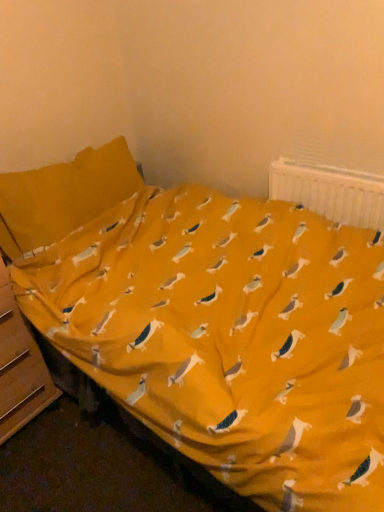
Question: Is point (337, 184) positioned closer to the camera than point (24, 404)?

Choices:
 (A) closer
 (B) farther

Answer: (A)

Question: Considering the relative positions of white plastic radiator at upper right and wooden file cabinet at lower left in the image provided, is white plastic radiator at upper right to the left or to the right of wooden file cabinet at lower left?

Choices:
 (A) right
 (B) left

Answer: (A)

Question: Considering their positions, is white plastic radiator at upper right located in front of or behind wooden file cabinet at lower left?

Choices:
 (A) behind
 (B) front

Answer: (A)

Question: Is wooden file cabinet at lower left inside the boundaries of white plastic radiator at upper right, or outside?

Choices:
 (A) inside
 (B) outside

Answer: (B)

Question: In terms of width, does wooden file cabinet at lower left look wider or thinner when compared to white plastic radiator at upper right?

Choices:
 (A) wide
 (B) thin

Answer: (A)

Question: From the image's perspective, is wooden file cabinet at lower left located above or below white plastic radiator at upper right?

Choices:
 (A) above
 (B) below

Answer: (B)

Question: From a real-world perspective, is wooden file cabinet at lower left physically located above or below white plastic radiator at upper right?

Choices:
 (A) above
 (B) below

Answer: (B)